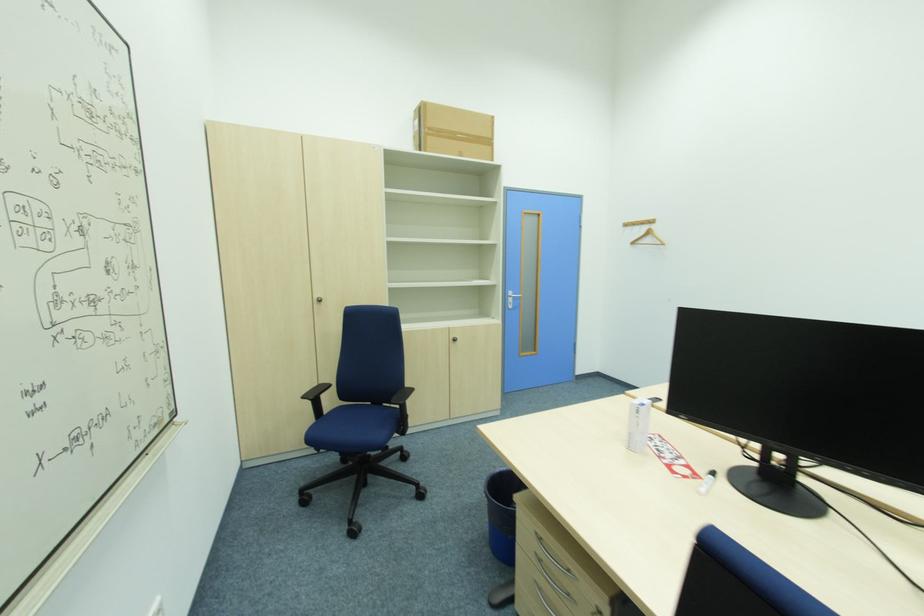
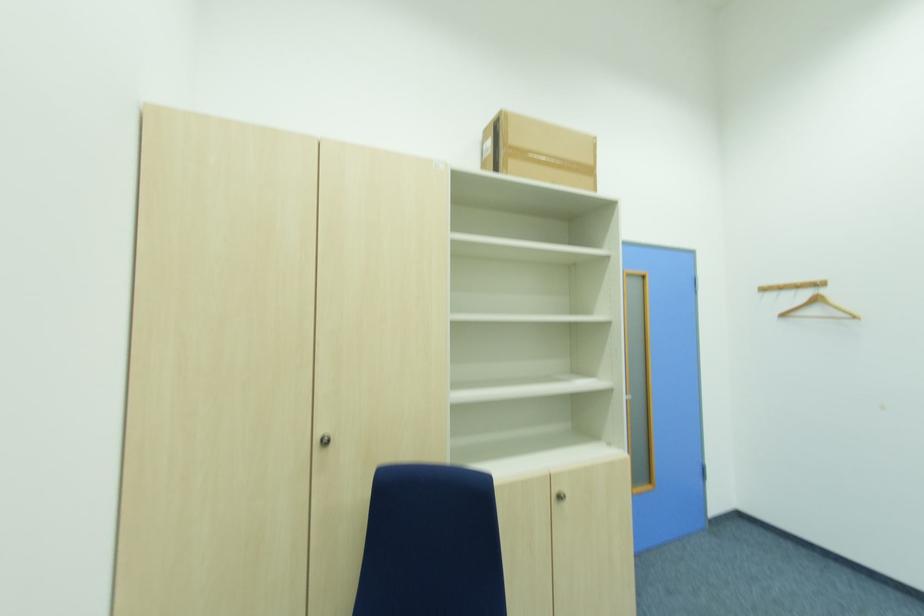
In the second image, find the point that corresponds to [458,342] in the first image.

(564, 499)